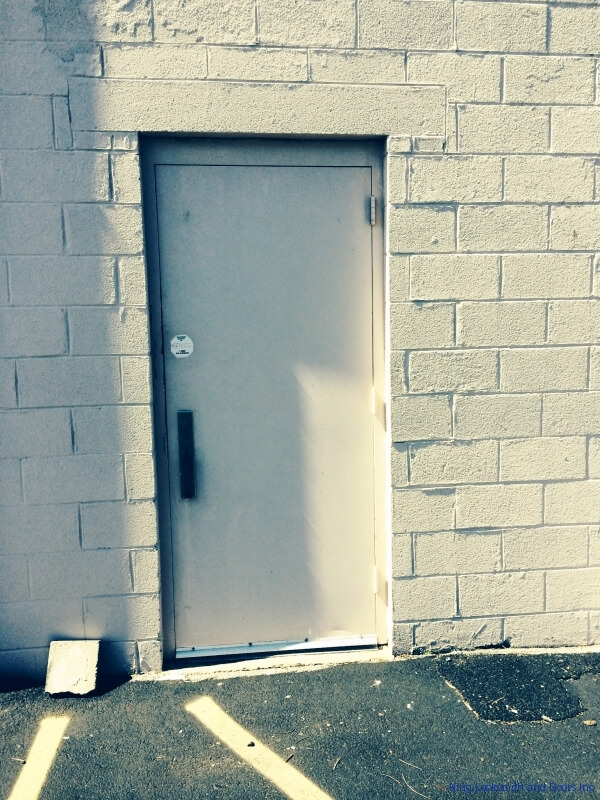
The width and height of the screenshot is (600, 800). What are the coordinates of `top hinge` in the screenshot? It's located at (371, 214).